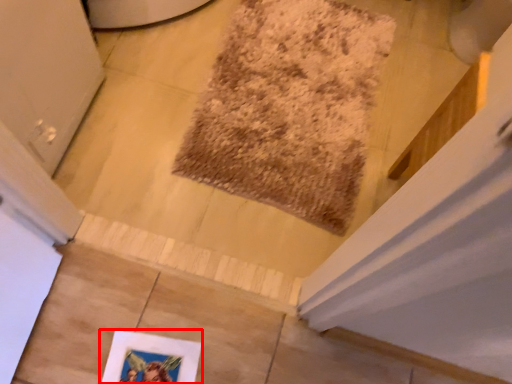
Question: From the image's perspective, where is picture frame (annotated by the red box) located relative to mat?

Choices:
 (A) below
 (B) above

Answer: (A)